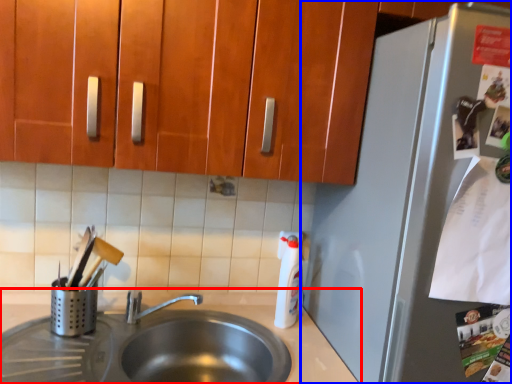
Question: Which object appears closest to the camera in this image, countertop (highlighted by a red box) or refrigerator (highlighted by a blue box)?

Choices:
 (A) countertop
 (B) refrigerator

Answer: (B)